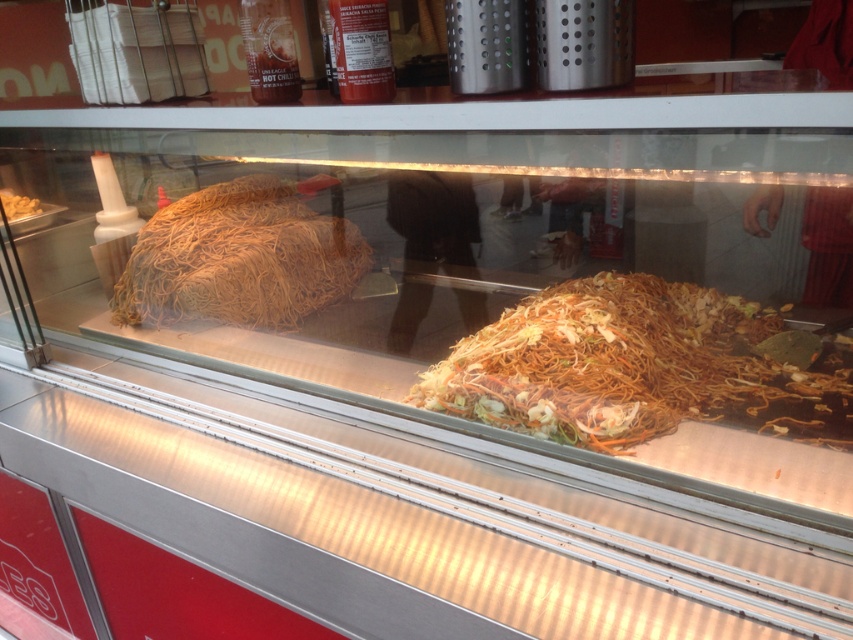
Consider the image. Which is above, brown matte noodles at left or white matte bread at upper left?

white matte bread at upper left

The height and width of the screenshot is (640, 853). I want to click on brown matte noodles at left, so click(241, 257).

This screenshot has width=853, height=640. Find the location of `brown matte noodles at left`. brown matte noodles at left is located at coordinates (241, 257).

What are the coordinates of `brown matte noodles at left` in the screenshot? It's located at (241, 257).

Can you confirm if shiny brown noodles at center is shorter than white matte bread at upper left?

Incorrect, shiny brown noodles at center's height does not fall short of white matte bread at upper left's.

Can you confirm if shiny brown noodles at center is bigger than white matte bread at upper left?

Yes, shiny brown noodles at center is bigger than white matte bread at upper left.

Image resolution: width=853 pixels, height=640 pixels. Describe the element at coordinates (631, 368) in the screenshot. I see `shiny brown noodles at center` at that location.

Where is `shiny brown noodles at center`? shiny brown noodles at center is located at coordinates (631, 368).

What do you see at coordinates (631, 368) in the screenshot? I see `shiny brown noodles at center` at bounding box center [631, 368].

Between point (498, 406) and point (259, 273), which one is positioned in front?

Positioned in front is point (498, 406).

The width and height of the screenshot is (853, 640). What are the coordinates of `shiny brown noodles at center` in the screenshot? It's located at (631, 368).